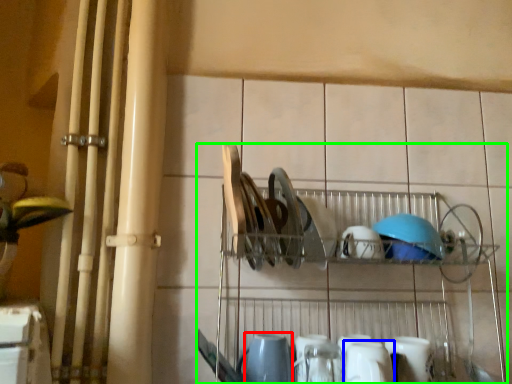
Question: Which object is positioned farthest from tableware (highlighted by a red box)? Select from tableware (highlighted by a blue box) and shelf (highlighted by a green box).

Choices:
 (A) tableware
 (B) shelf

Answer: (B)